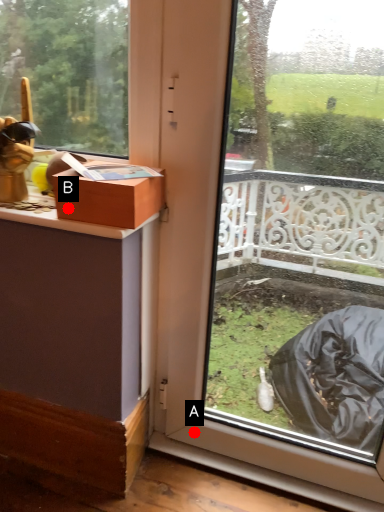
Question: Two points are circled on the image, labeled by A and B beside each circle. Which point appears closest to the camera in this image?

Choices:
 (A) A is closer
 (B) B is closer

Answer: (B)